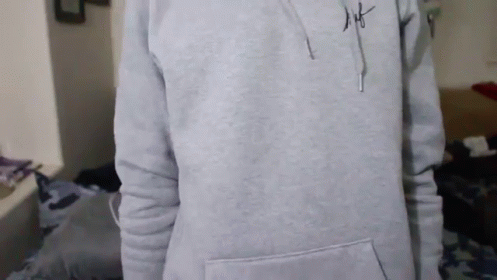
Where is `the top left corner of the headboard`? the top left corner of the headboard is located at coordinates (125, 89).